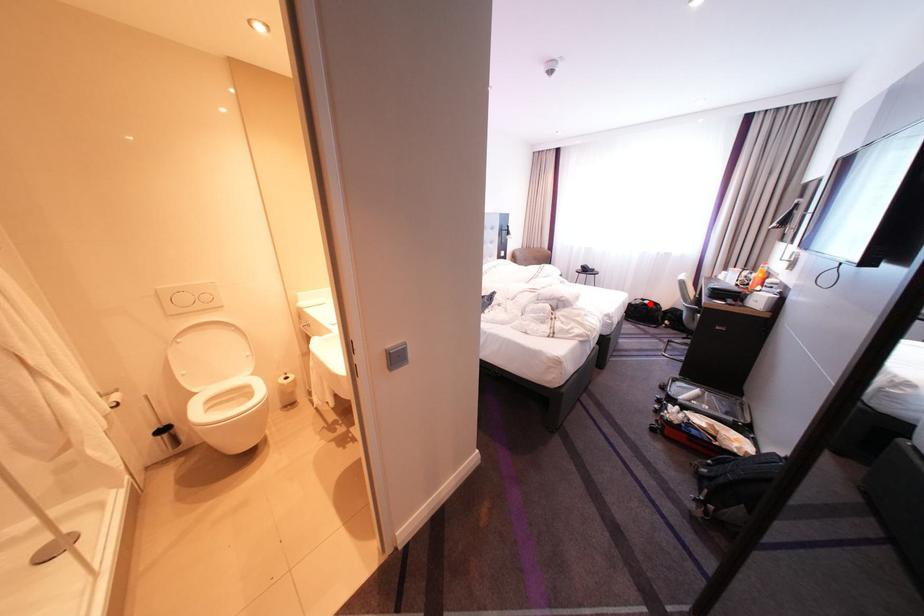
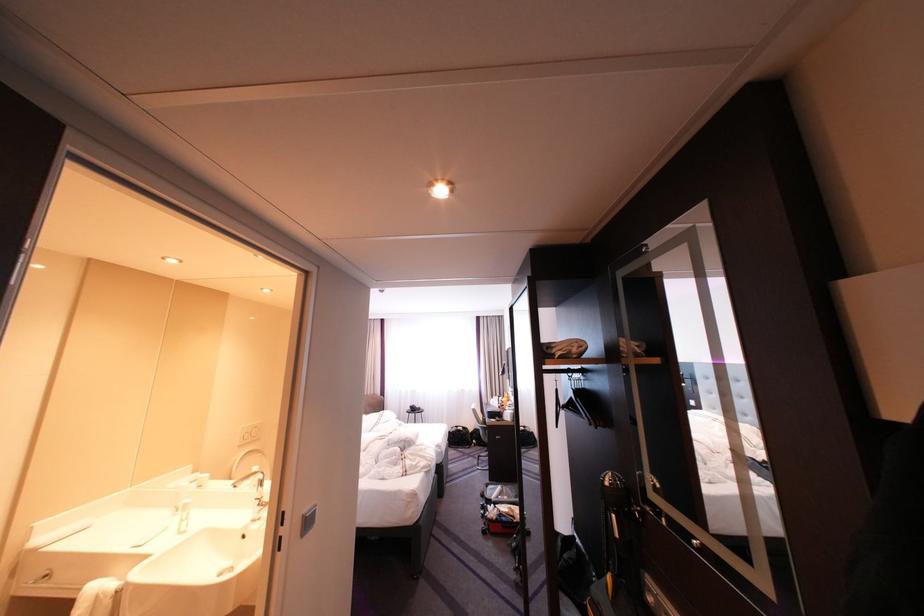
In the second image, find the point that corresponds to the highlighted location in the first image.

(467, 431)